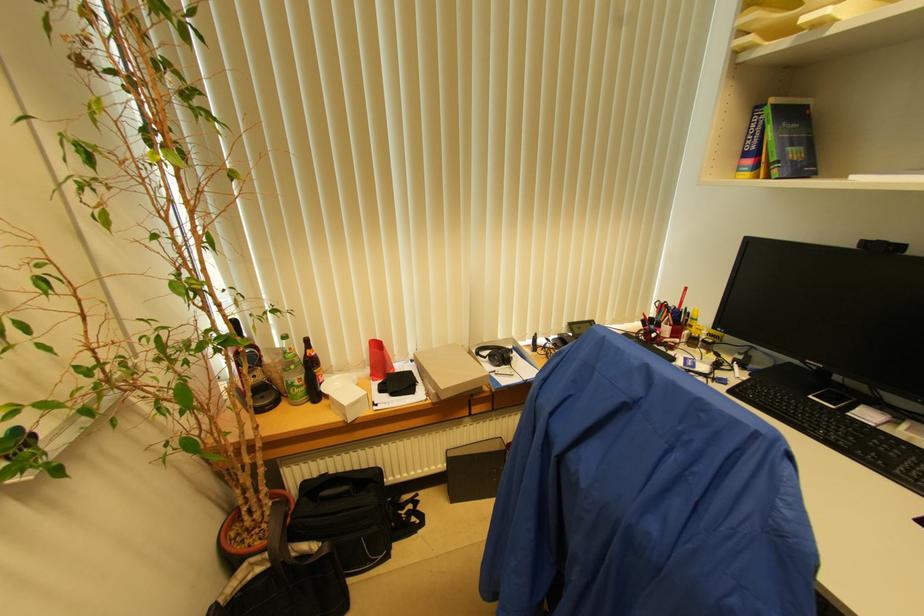
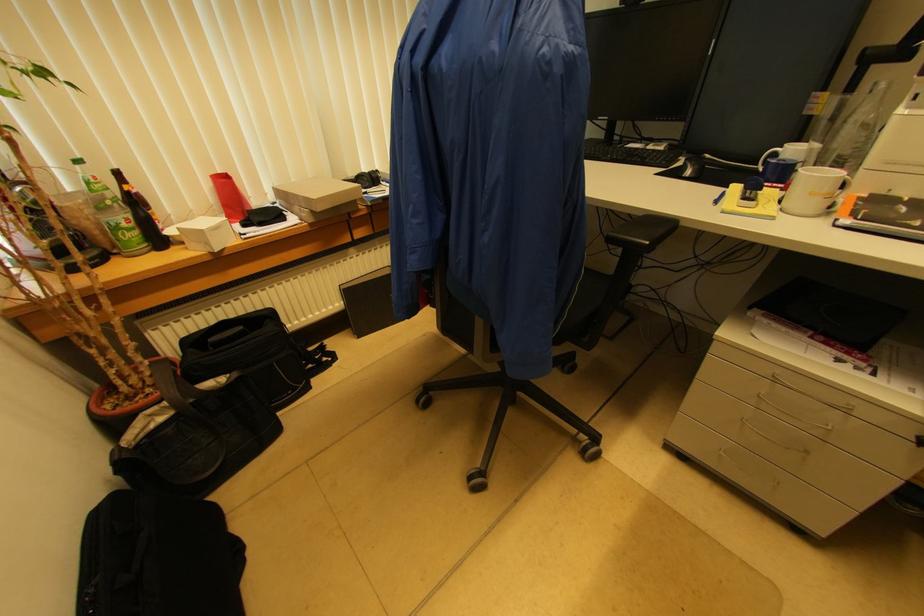
Where in the second image is the point corresponding to point (304, 379) from the first image?

(131, 219)